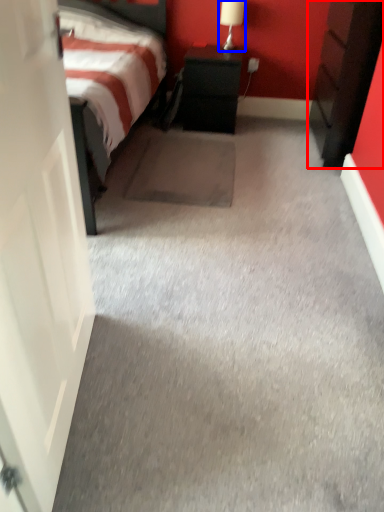
Question: Which object appears closest to the camera in this image, nightstand (highlighted by a red box) or table lamp (highlighted by a blue box)?

Choices:
 (A) nightstand
 (B) table lamp

Answer: (A)